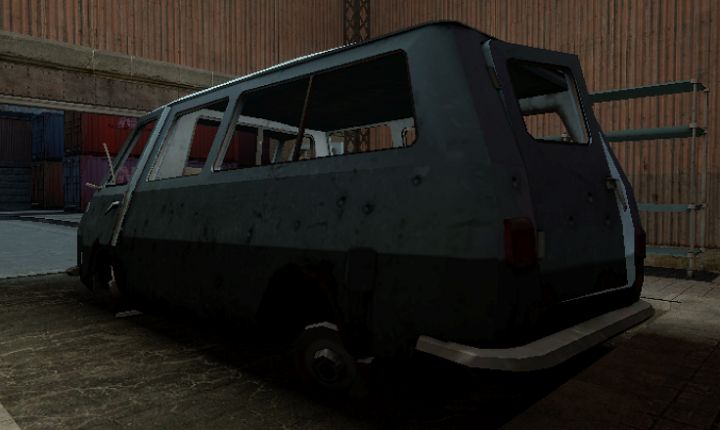
Identify the location of metal shelves. (654, 92), (654, 138), (662, 202), (667, 249).